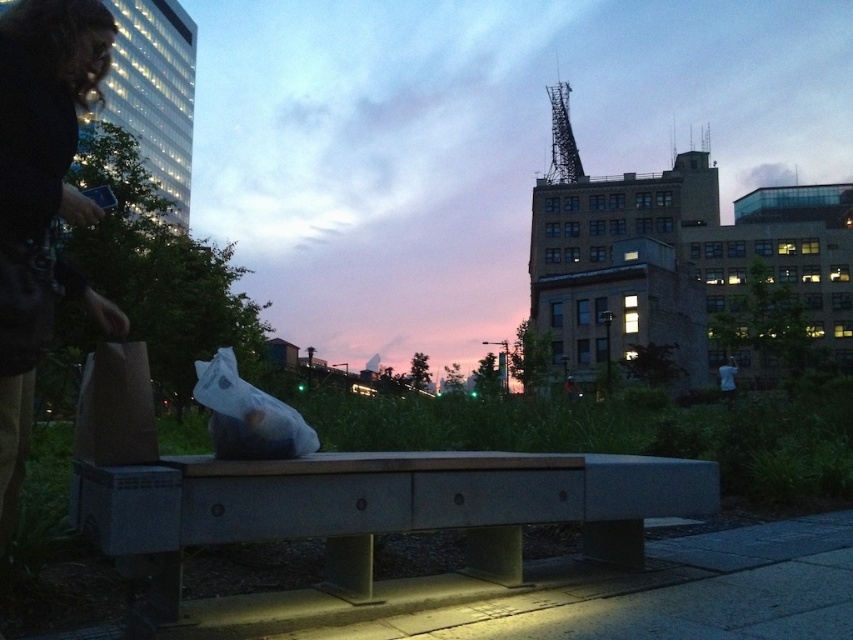
Question: Which point is closer to the camera?

Choices:
 (A) concrete bench at center
 (B) metallic structure at upper right

Answer: (A)

Question: Is concrete bench at center to the left of metallic structure at upper right from the viewer's perspective?

Choices:
 (A) yes
 (B) no

Answer: (A)

Question: Considering the relative positions of concrete bench at center and metallic structure at upper right in the image provided, where is concrete bench at center located with respect to metallic structure at upper right?

Choices:
 (A) left
 (B) right

Answer: (A)

Question: Can you confirm if concrete bench at center is positioned to the left of metallic structure at upper right?

Choices:
 (A) yes
 (B) no

Answer: (A)